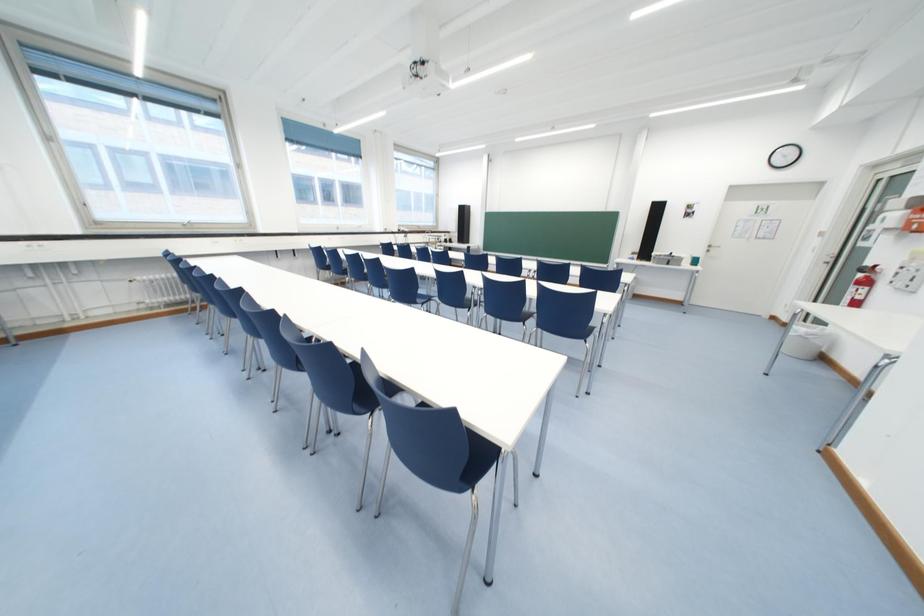
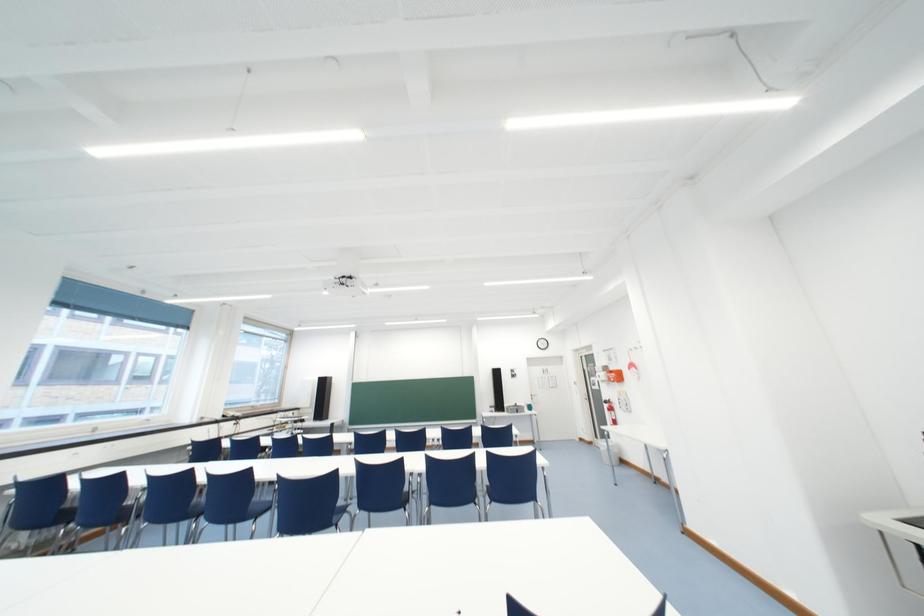
Based on the photo, the images are taken continuously from a first-person perspective. In which direction is your viewpoint rotating?

The camera rotated toward right-up.